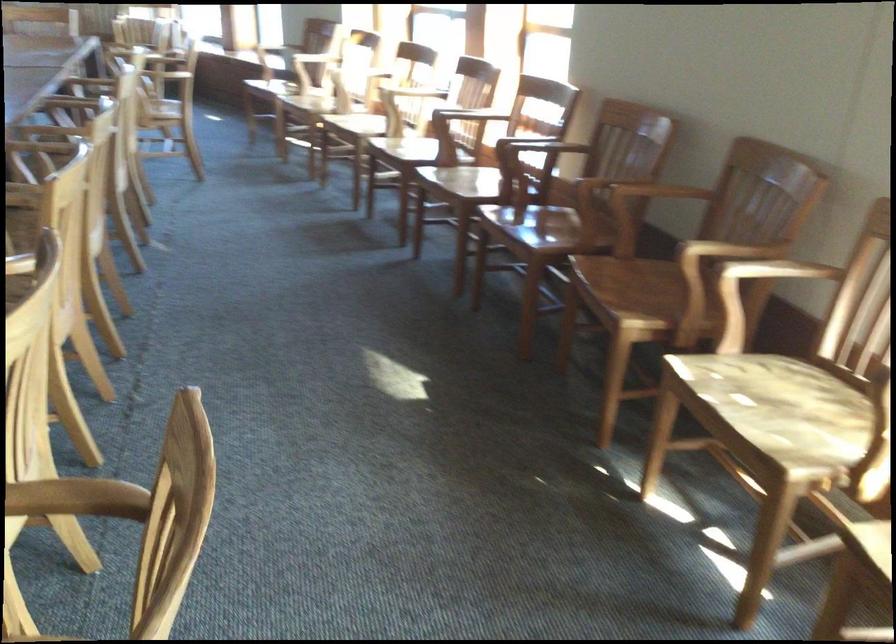
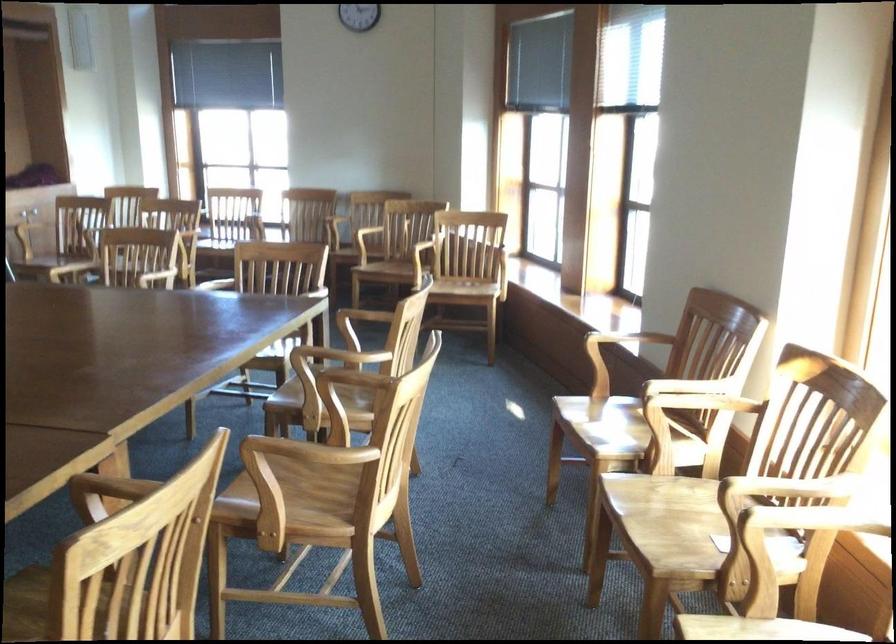
Locate, in the second image, the point that corresponds to pixel 139 118 in the first image.

(294, 489)